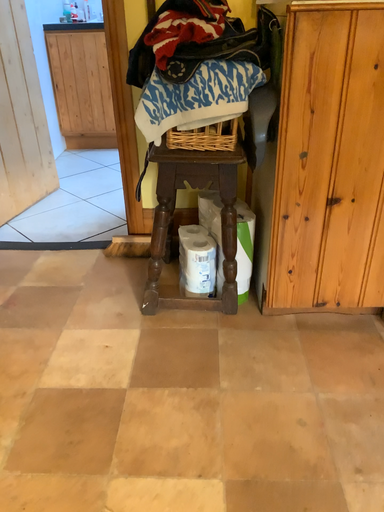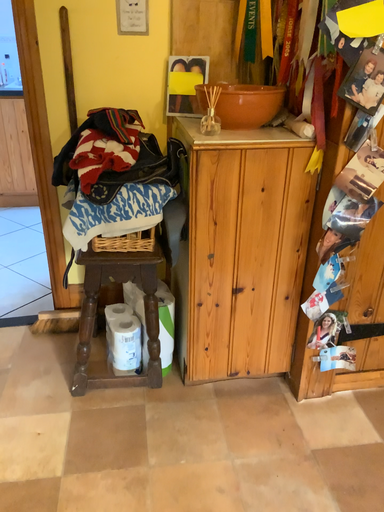
Question: How did the camera likely rotate when shooting the video?

Choices:
 (A) rotated left
 (B) rotated right

Answer: (B)